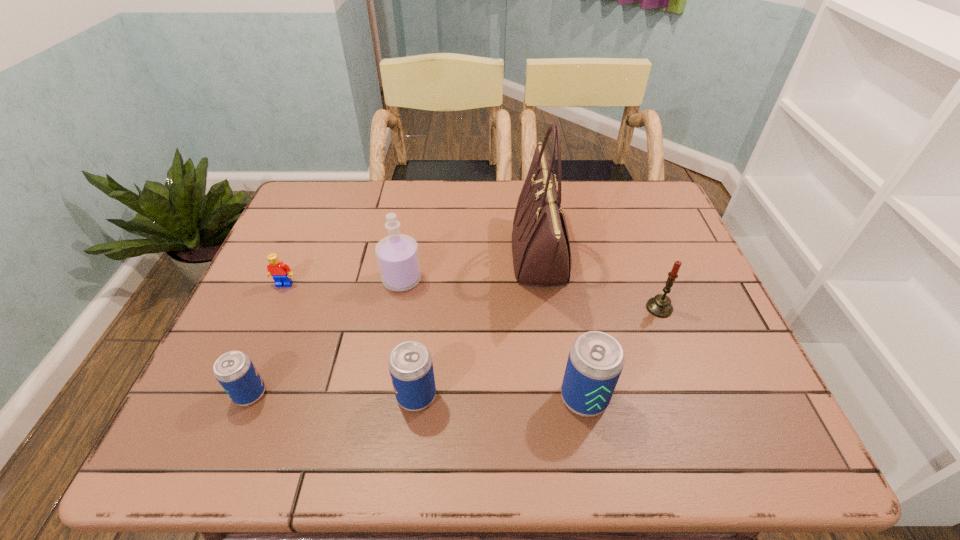
The width and height of the screenshot is (960, 540). In order to click on object that is at the near left corner in this screenshot , I will do `click(234, 370)`.

Locate an element on the screen. Image resolution: width=960 pixels, height=540 pixels. vacant space at the far edge is located at coordinates (491, 226).

In the image, there is a desktop. Identify the location of free space at the near edge. (618, 382).

This screenshot has width=960, height=540. In the image, there is a desktop. Identify the location of free space at the left edge. (281, 359).

Identify the location of vacant space at the right edge. This screenshot has width=960, height=540. (696, 303).

Locate an element on the screen. The width and height of the screenshot is (960, 540). vacant area at the near left corner of the desktop is located at coordinates (283, 371).

Find the location of a particular element. This screenshot has width=960, height=540. vacant space at the far right corner of the desktop is located at coordinates (638, 209).

Where is `vacant region between the perfume and the candle`? This screenshot has width=960, height=540. vacant region between the perfume and the candle is located at coordinates (531, 294).

I want to click on vacant region between the second tallest beer can and the second tallest object, so click(x=409, y=338).

Locate an element on the screen. empty space that is in between the candle and the second shortest beer can is located at coordinates (538, 352).